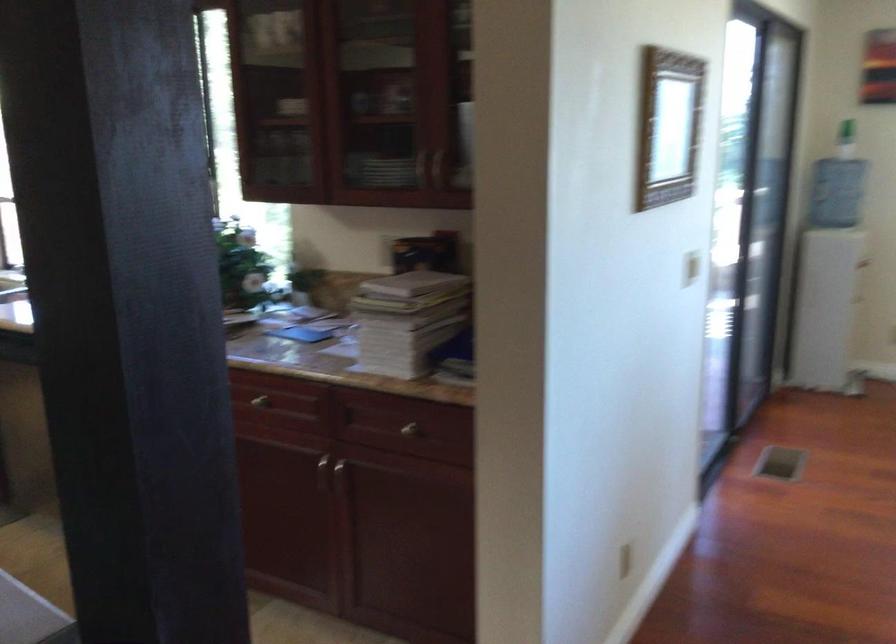
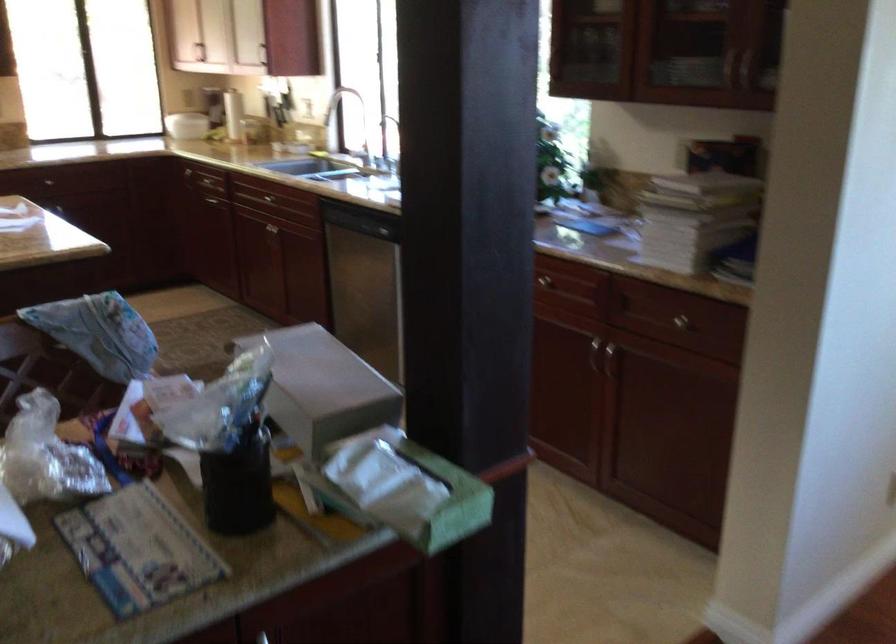
Where in the second image is the point corresponding to point (405, 431) from the first image?

(682, 323)